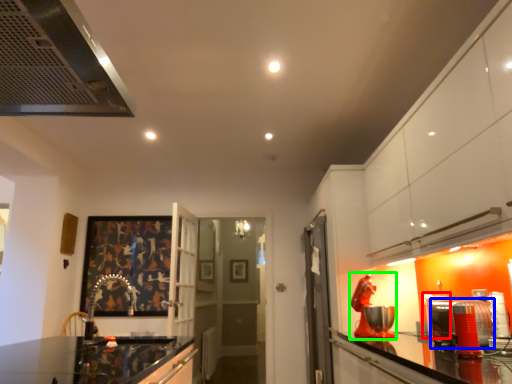
Question: Based on their relative distances, which object is nearer to appliance (highlighted by a red box)? Choose from appliance (highlighted by a blue box) and appliance (highlighted by a green box).

Choices:
 (A) appliance
 (B) appliance

Answer: (B)